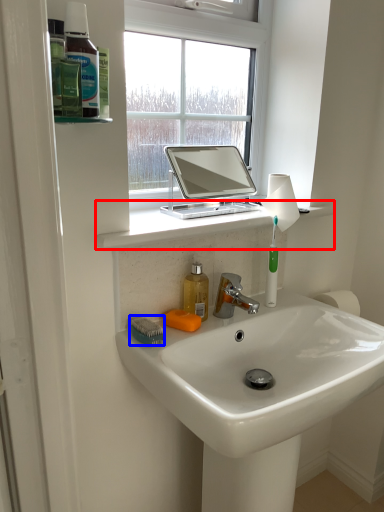
Question: Which of the following is the farthest to the observer, counter top (highlighted by a red box) or brush (highlighted by a blue box)?

Choices:
 (A) counter top
 (B) brush

Answer: (B)